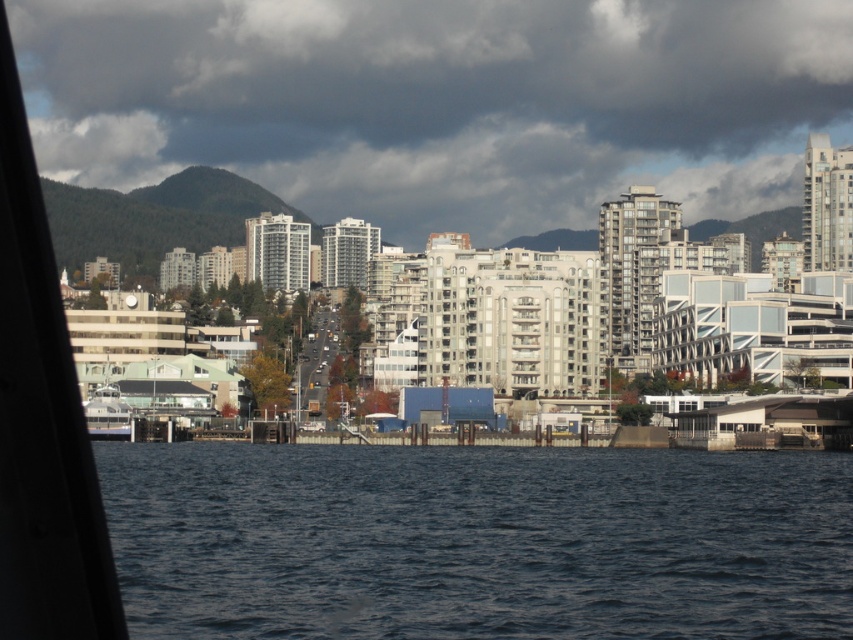
Based on the photo, you are a photographer planning to capture the waterfront cityscape. You want to ensure the dark blue water at center and the white glossy ferry at lower left are both visible in your shot. Given their sizes, which object should you focus on to frame the scene appropriately?

The dark blue water at center is larger in size compared to the white glossy ferry at lower left. To frame the scene appropriately, focus on the dark blue water at center as the main subject while ensuring the white glossy ferry at lower left is also visible in the composition.

You are standing at the waterfront and want to know how far the point at coordinates (675, 636) is from your current position. Can you determine the distance?

The distance between the point at coordinates (675, 636) and your current position is 632.44 feet.

You are an urban planner analyzing the cityscape. You notice the dark gray cloud at upper center in the image. Based on its position, can you determine if it is closer to the waterfront or the highrise buildings?

The dark gray cloud at upper center is located at point coordinates that place it closer to the waterfront than the highrise buildings.